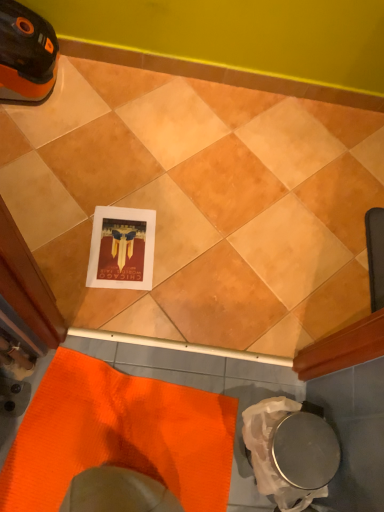
At what (x,y) coordinates should I click in order to perform the action: click on orange textured bath towel at lower center. Please return your answer as a coordinate pair (x, y). Image resolution: width=384 pixels, height=512 pixels. Looking at the image, I should click on (118, 436).

What do you see at coordinates (118, 436) in the screenshot? The height and width of the screenshot is (512, 384). I see `orange textured bath towel at lower center` at bounding box center [118, 436].

The width and height of the screenshot is (384, 512). Identify the location of orange textured bath towel at lower center. (x=118, y=436).